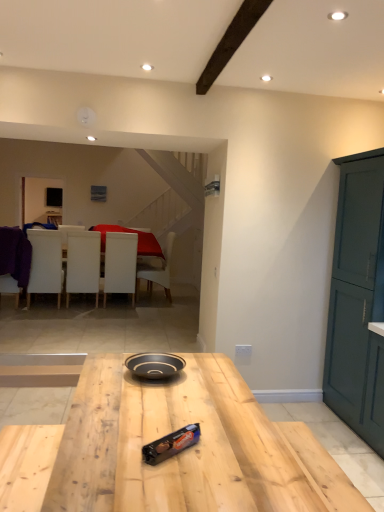
Question: Can you confirm if natural wood table at center is thinner than shiny chocolate bar at center?

Choices:
 (A) yes
 (B) no

Answer: (B)

Question: From a real-world perspective, is natural wood table at center under shiny chocolate bar at center?

Choices:
 (A) no
 (B) yes

Answer: (B)

Question: Considering the relative sizes of natural wood table at center and shiny chocolate bar at center in the image provided, is natural wood table at center bigger than shiny chocolate bar at center?

Choices:
 (A) no
 (B) yes

Answer: (B)

Question: Is natural wood table at center completely or partially outside of shiny chocolate bar at center?

Choices:
 (A) yes
 (B) no

Answer: (A)

Question: Does natural wood table at center appear on the right side of shiny chocolate bar at center?

Choices:
 (A) yes
 (B) no

Answer: (B)

Question: From a real-world perspective, is purple fabric chair at left, the 1th chair in the left-to-right sequence, above or below white leather chair at center, which appears as the fifth chair when viewed from the left?

Choices:
 (A) below
 (B) above

Answer: (B)

Question: Is purple fabric chair at left, the 1th chair in the left-to-right sequence, in front of or behind white leather chair at center, the first chair positioned from the right, in the image?

Choices:
 (A) front
 (B) behind

Answer: (A)

Question: In the image, is purple fabric chair at left, the 1th chair in the left-to-right sequence, on the left side or the right side of white leather chair at center, the first chair positioned from the right?

Choices:
 (A) right
 (B) left

Answer: (B)

Question: From the image's perspective, is purple fabric chair at left, the 5th chair in the right-to-left sequence, positioned above or below white leather chair at center, the first chair positioned from the right?

Choices:
 (A) above
 (B) below

Answer: (A)

Question: From a real-world perspective, is white leather chair at center, the first chair positioned from the right, positioned above or below purple fabric chair at left, the 5th chair in the right-to-left sequence?

Choices:
 (A) below
 (B) above

Answer: (A)

Question: Is white leather chair at center, which appears as the fifth chair when viewed from the left, inside the boundaries of purple fabric chair at left, the 1th chair in the left-to-right sequence, or outside?

Choices:
 (A) outside
 (B) inside

Answer: (A)

Question: Does point (x=162, y=280) appear closer or farther from the camera than point (x=1, y=292)?

Choices:
 (A) farther
 (B) closer

Answer: (A)

Question: In terms of size, does white leather chair at center, which appears as the fifth chair when viewed from the left, appear bigger or smaller than purple fabric chair at left, the 5th chair in the right-to-left sequence?

Choices:
 (A) small
 (B) big

Answer: (B)

Question: Considering the positions of purple fabric chair at left, the 5th chair in the right-to-left sequence, and white matte chair at left, the 2th chair in the left-to-right sequence, in the image, is purple fabric chair at left, the 5th chair in the right-to-left sequence, taller or shorter than white matte chair at left, the 2th chair in the left-to-right sequence,?

Choices:
 (A) tall
 (B) short

Answer: (B)

Question: Which is correct: purple fabric chair at left, the 1th chair in the left-to-right sequence, is inside white matte chair at left, the 2th chair in the left-to-right sequence, or outside of it?

Choices:
 (A) outside
 (B) inside

Answer: (A)